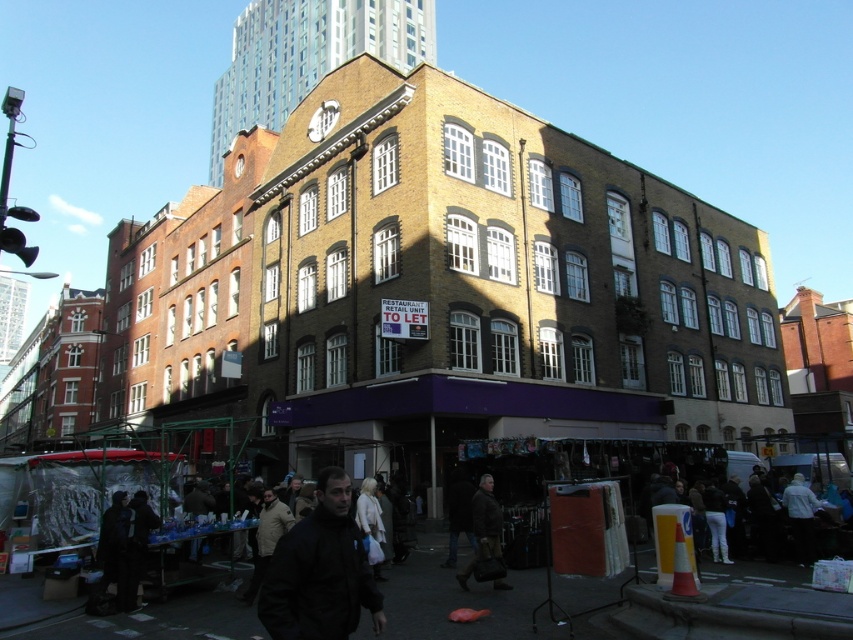
Question: Observing the image, what is the correct spatial positioning of black matte jacket at lower center in reference to white fabric coat at center?

Choices:
 (A) below
 (B) above

Answer: (B)

Question: Does black matte jacket at lower center have a larger size compared to brown leather jacket at center?

Choices:
 (A) yes
 (B) no

Answer: (A)

Question: Based on their relative distances, which object is nearer to the black matte jacket at lower center?

Choices:
 (A) white fabric coat at center
 (B) brown leather jacket at center

Answer: (A)

Question: Based on their relative distances, which object is farther from the black matte jacket at lower center?

Choices:
 (A) white fabric coat at center
 (B) brown leather jacket at center

Answer: (B)

Question: Among these points, which one is nearest to the camera?

Choices:
 (A) (370, 484)
 (B) (479, 532)
 (C) (339, 570)

Answer: (C)

Question: Is brown leather jacket at center positioned behind white fabric coat at center?

Choices:
 (A) no
 (B) yes

Answer: (B)